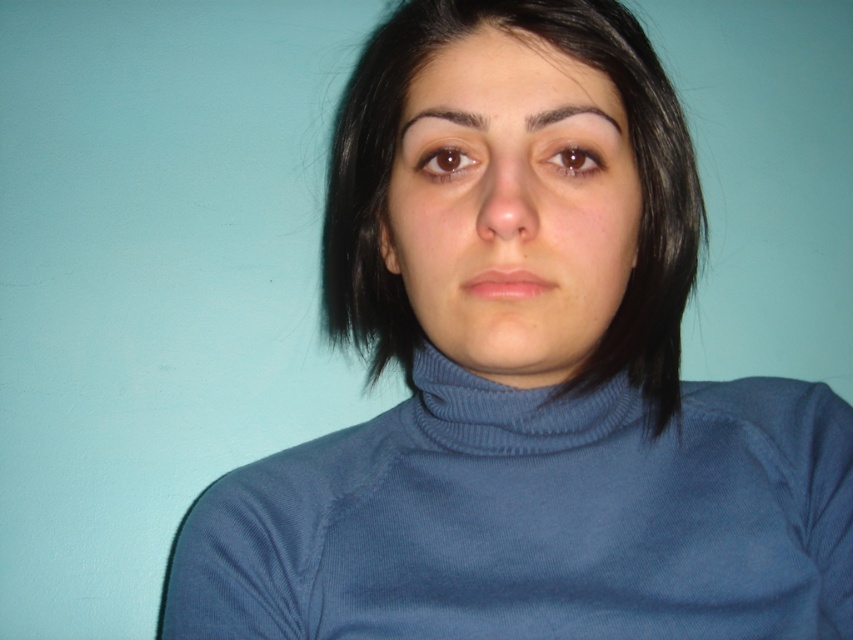
You are a photographer adjusting the focus on your camera. You want to ensure that both the matte blue turtleneck at center and the brownhaireyebrow at upper center are in focus. Based on their positions, which object should you focus on first to achieve sharpness for both?

You should focus on the matte blue turtleneck at center first since it is closer to the viewer. By focusing on the closer object, the brownhaireyebrow at upper center, which is farther away, will also come into focus due to the depth of field.

You are an AI analyzing a portrait. The image shows a person in a blue turtleneck against a light teal background. A point at coordinates (512, 209) is marked. What object does this point correspond to?

The point at coordinates (512, 209) corresponds to the matte blue turtleneck at center.

You are a photographer adjusting the focus of your camera. You want to ensure that both the matte blue turtleneck at center and the dark brown hair at upper center are in sharp focus. Given their positions, which object should you focus on first to achieve this?

The matte blue turtleneck at center is closer to the viewer than the dark brown hair at upper center. To ensure both are in focus, you should focus on the matte blue turtleneck at center first, as it is the closer object, and adjust the depth of field accordingly.